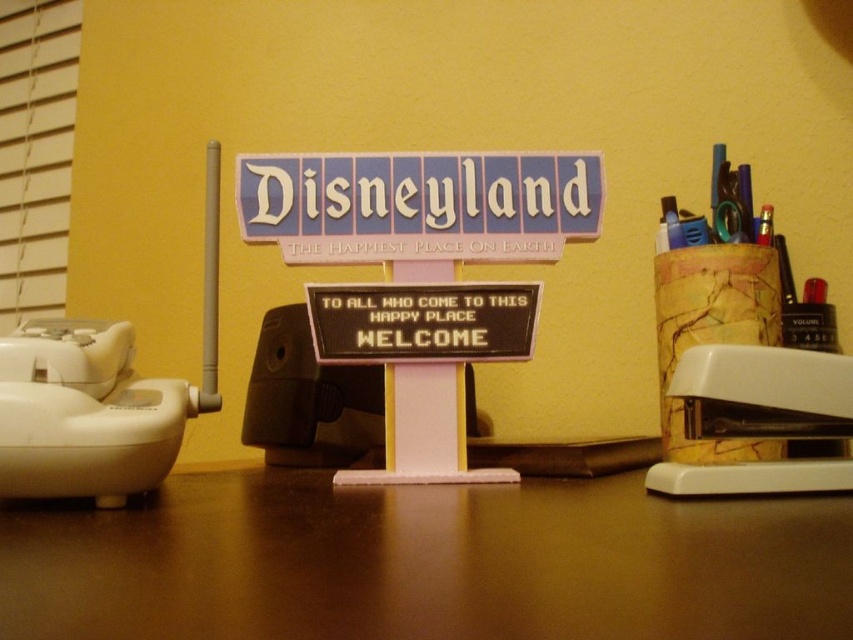
You have a small box that is 5 cm wide. You need to place it on the desk next to the white plastic stapler at lower left and the metallic gold pen at right. Which object should you place it next to if the box is wider than the pen but narrower than the stapler?

The box should be placed next to the metallic gold pen at right because the white plastic stapler at lower left is wider than the metallic gold pen at right, and the box is narrower than the stapler but wider than the pen.

You are setting up a desk and want to place a wireless charger that requires at least 18 inches of space between it and any metal objects to function properly. You have a wooden textured pencil holder at right and a white device with a long antenna to the left. Are these two items placed far enough apart to ensure the wireless charger works properly?

The wooden textured pencil holder at right and the white device with a long antenna are 22.56 inches apart, which is more than the required 18 inches. Therefore, the wireless charger should function properly as they are sufficiently spaced apart.